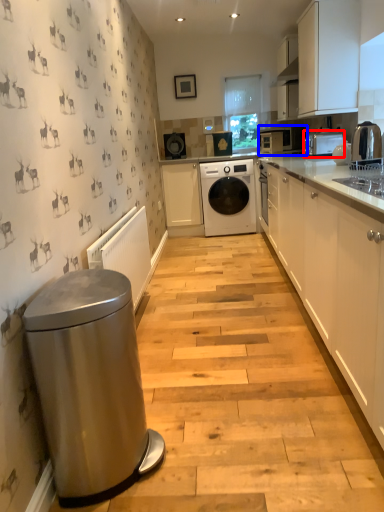
Question: Which of the following is the farthest to the observer, home appliance (highlighted by a red box) or home appliance (highlighted by a blue box)?

Choices:
 (A) home appliance
 (B) home appliance

Answer: (B)